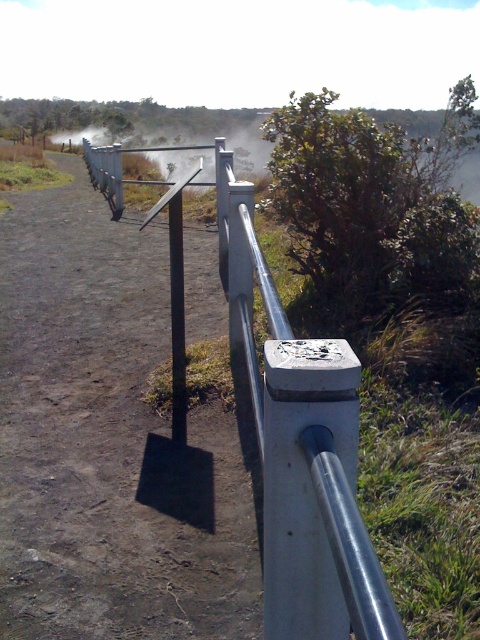
You are a gardener who needs to walk along the metallic gray path at center while avoiding the silver metallic fence at center. Since the path is narrower, will you have enough space to walk safely?

The metallic gray path at center has a lesser width compared to the silver metallic fence at center, so you may have limited space to walk safely. Proceed with caution to avoid the fence.